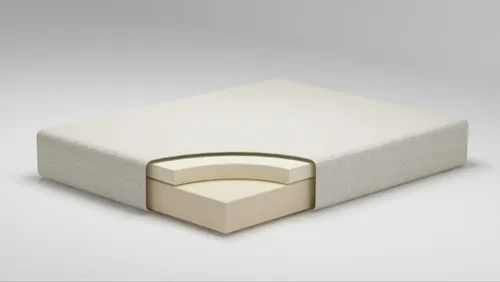
At what (x,y) coordinates should I click in order to perform the action: click on artwork. Please return your answer as a coordinate pair (x, y). This screenshot has width=500, height=282. Looking at the image, I should click on (293, 171).